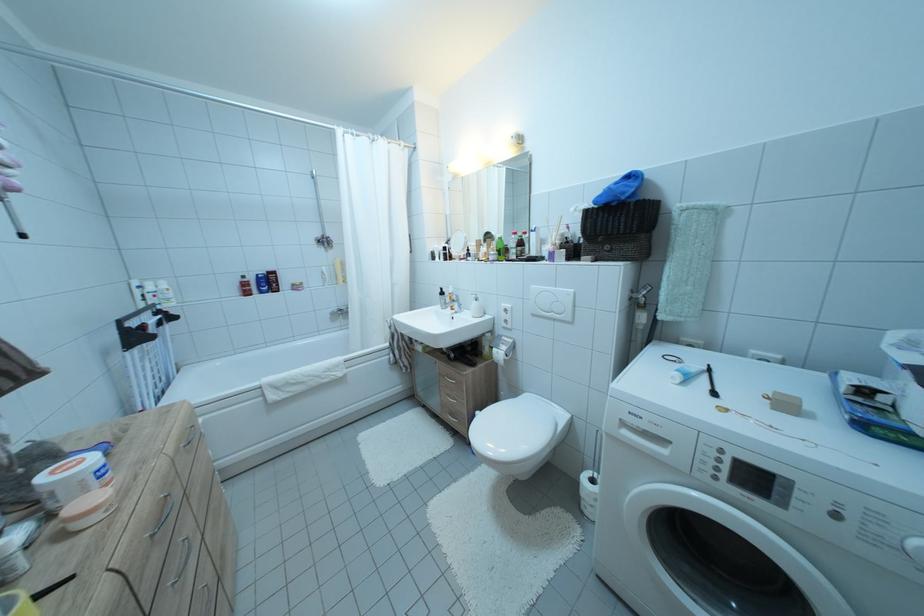
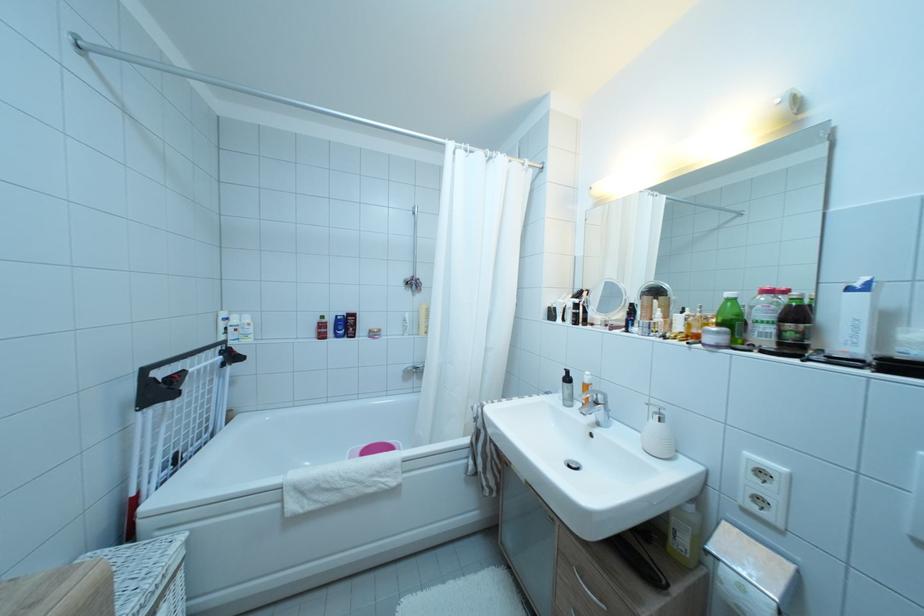
Where in the second image is the point corresponding to point (454, 300) from the first image?

(585, 390)